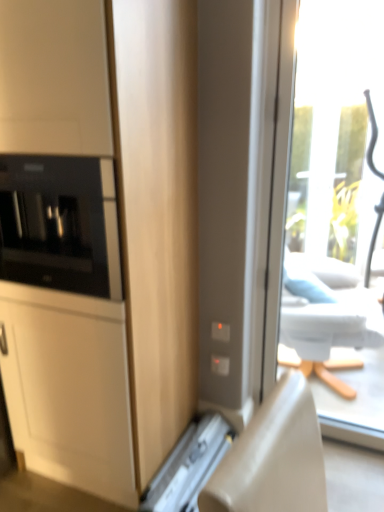
Question: Considering their positions, is black glass microwave at left located in front of or behind metallic silver drawer at lower center?

Choices:
 (A) front
 (B) behind

Answer: (A)

Question: From the image's perspective, is black glass microwave at left above or below metallic silver drawer at lower center?

Choices:
 (A) above
 (B) below

Answer: (A)

Question: Considering the real-world distances, which object is farthest from the metallic silver drawer at lower center?

Choices:
 (A) matte wood cabinet at left
 (B) black glass microwave at left

Answer: (B)

Question: Estimate the real-world distances between objects in this image. Which object is closer to the matte wood cabinet at left?

Choices:
 (A) black glass microwave at left
 (B) metallic silver drawer at lower center

Answer: (A)